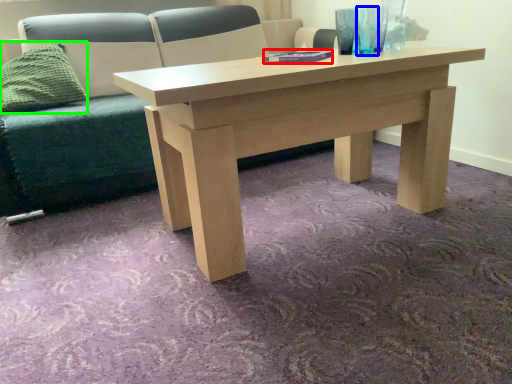
Question: Which is farther away from book (highlighted by a red box)? glass vase (highlighted by a blue box) or pillow (highlighted by a green box)?

Choices:
 (A) glass vase
 (B) pillow

Answer: (B)